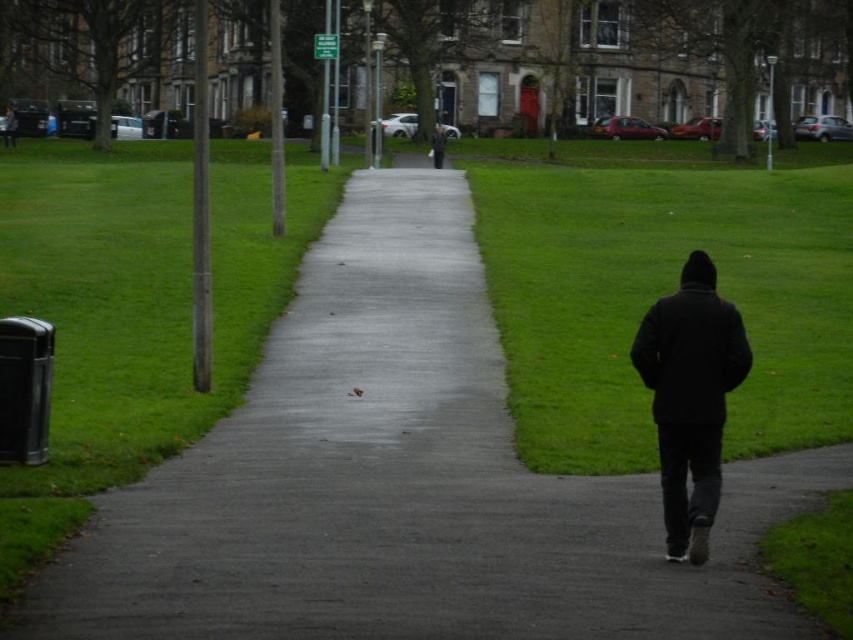
You are a park visitor who wants to pick up an item from the black matte jacket at lower right and the black matte jacket at center. Which one is closer to you?

The black matte jacket at lower right is closer to you because it is in front of the black matte jacket at center.

You are a delivery person who needs to place a package on the concrete at center. However, there is a black matte jacket at lower right nearby. According to the scene, where exactly should you place the package so it doesn

The concrete at center is positioned on the left side of the black matte jacket at lower right, so you should place the package on the concrete at center which is to the left of the black matte jacket at lower right to ensure it is not obstructed.